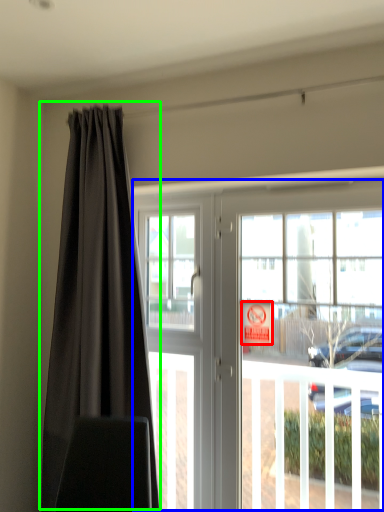
Question: Which object is positioned farthest from parking sign (highlighted by a red box)? Select from door (highlighted by a blue box) and curtain (highlighted by a green box).

Choices:
 (A) door
 (B) curtain

Answer: (B)